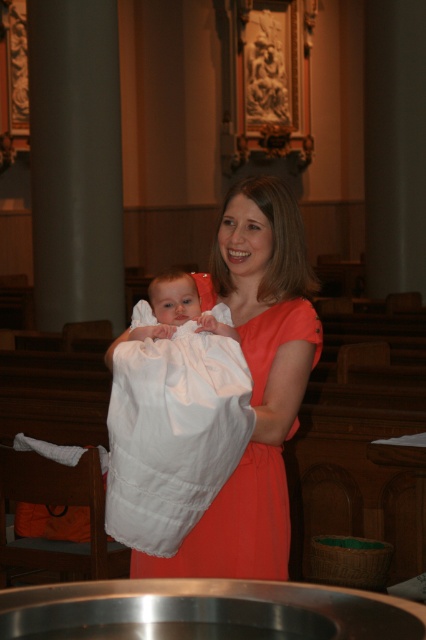
You are a photographer planning to take a portrait of the woman and baby in the church. You need to ensure that both the orange satin dress at center and the white soft cloth at center are clearly visible in the frame. Given their size difference, which object should you focus on to ensure both are in focus?

The orange satin dress at center is larger in size than the white soft cloth at center, so focusing on the orange satin dress at center will help ensure both objects are in focus since it is the larger and more dominant object in the scene.